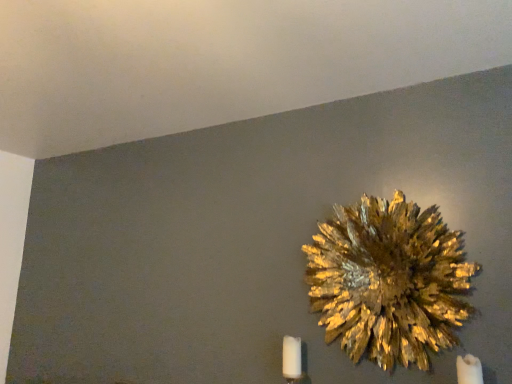
Question: Considering the relative positions of white matte candle at lower right, arranged as the first candle when viewed from the right, and white matte candle at lower right, acting as the 2th candle starting from the right, in the image provided, is white matte candle at lower right, arranged as the first candle when viewed from the right, to the left of white matte candle at lower right, acting as the 2th candle starting from the right, from the viewer's perspective?

Choices:
 (A) no
 (B) yes

Answer: (A)

Question: Is white matte candle at lower right, arranged as the 2th candle when viewed from the left, wider than white matte candle at lower right, the 2th candle positioned from the front?

Choices:
 (A) yes
 (B) no

Answer: (A)

Question: From the image's perspective, is white matte candle at lower right, arranged as the first candle when viewed from the right, on top of white matte candle at lower right, acting as the 1th candle starting from the back?

Choices:
 (A) no
 (B) yes

Answer: (B)

Question: Can you confirm if white matte candle at lower right, the second candle from the back, is smaller than white matte candle at lower right, the 2th candle positioned from the front?

Choices:
 (A) no
 (B) yes

Answer: (A)

Question: From the image's perspective, is white matte candle at lower right, the first candle in the front-to-back sequence, below white matte candle at lower right, acting as the 2th candle starting from the right?

Choices:
 (A) yes
 (B) no

Answer: (B)

Question: From a real-world perspective, is white matte candle at lower right, the second candle from the back, on white matte candle at lower right, the 2th candle positioned from the front?

Choices:
 (A) no
 (B) yes

Answer: (A)

Question: Considering the relative sizes of white matte candle at lower right, arranged as the 2th candle when viewed from the left, and gold textured flower at upper right in the image provided, is white matte candle at lower right, arranged as the 2th candle when viewed from the left, bigger than gold textured flower at upper right?

Choices:
 (A) no
 (B) yes

Answer: (A)

Question: Does white matte candle at lower right, the first candle in the front-to-back sequence, appear on the left side of gold textured flower at upper right?

Choices:
 (A) yes
 (B) no

Answer: (B)

Question: Considering the relative positions of white matte candle at lower right, arranged as the 2th candle when viewed from the left, and gold textured flower at upper right in the image provided, is white matte candle at lower right, arranged as the 2th candle when viewed from the left, in front of gold textured flower at upper right?

Choices:
 (A) yes
 (B) no

Answer: (A)

Question: From a real-world perspective, is white matte candle at lower right, the first candle in the front-to-back sequence, physically below gold textured flower at upper right?

Choices:
 (A) no
 (B) yes

Answer: (B)

Question: Can you confirm if white matte candle at lower right, the second candle from the back, is taller than gold textured flower at upper right?

Choices:
 (A) yes
 (B) no

Answer: (B)

Question: Does white matte candle at lower right, arranged as the first candle when viewed from the right, have a greater width compared to gold textured flower at upper right?

Choices:
 (A) yes
 (B) no

Answer: (A)

Question: Could you tell me if gold textured flower at upper right is facing white matte candle at lower right, the 2th candle positioned from the front?

Choices:
 (A) yes
 (B) no

Answer: (B)